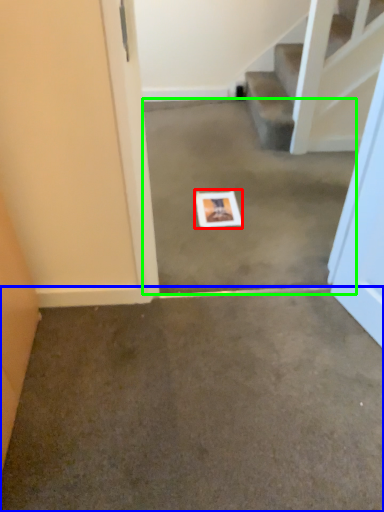
Question: Estimate the real-world distances between objects in this image. Which object is farther from postcard (highlighted by a red box), concrete (highlighted by a blue box) or concrete (highlighted by a green box)?

Choices:
 (A) concrete
 (B) concrete

Answer: (A)